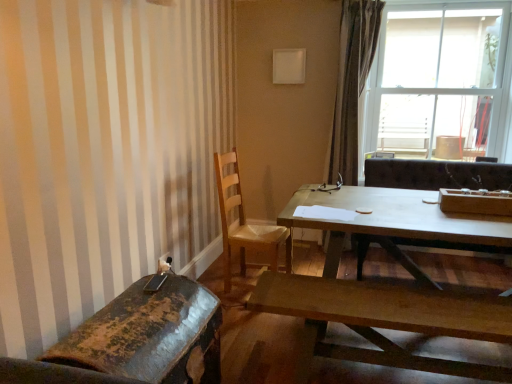
Question: Is transparent glass window at upper right shorter than rusty metal chair at lower left, the 2th chair positioned from the back?

Choices:
 (A) no
 (B) yes

Answer: (A)

Question: Is transparent glass window at upper right far from rusty metal chair at lower left, the 2th chair positioned from the back?

Choices:
 (A) no
 (B) yes

Answer: (B)

Question: Does transparent glass window at upper right have a greater height compared to rusty metal chair at lower left, which is counted as the 1th chair, starting from the front?

Choices:
 (A) no
 (B) yes

Answer: (B)

Question: Can you confirm if transparent glass window at upper right is wider than rusty metal chair at lower left, the 2th chair positioned from the back?

Choices:
 (A) no
 (B) yes

Answer: (B)

Question: Does transparent glass window at upper right have a larger size compared to rusty metal chair at lower left, which is counted as the 1th chair, starting from the front?

Choices:
 (A) no
 (B) yes

Answer: (B)

Question: From the image's perspective, does transparent glass window at upper right appear higher than rusty metal chair at lower left, which is counted as the 1th chair, starting from the front?

Choices:
 (A) yes
 (B) no

Answer: (A)

Question: Can you confirm if rusty metal chair at lower left, the 2th chair positioned from the back, is wider than wooden chair at center, arranged as the 1th chair when viewed from the back?

Choices:
 (A) no
 (B) yes

Answer: (A)

Question: Is the depth of rusty metal chair at lower left, which is counted as the 1th chair, starting from the front, greater than that of wooden chair at center, the 2th chair viewed from the front?

Choices:
 (A) yes
 (B) no

Answer: (B)

Question: Is rusty metal chair at lower left, which is counted as the 1th chair, starting from the front, at the left side of wooden chair at center, arranged as the 1th chair when viewed from the back?

Choices:
 (A) no
 (B) yes

Answer: (B)

Question: Is rusty metal chair at lower left, which is counted as the 1th chair, starting from the front, not close to wooden chair at center, the 2th chair viewed from the front?

Choices:
 (A) yes
 (B) no

Answer: (A)

Question: From a real-world perspective, is rusty metal chair at lower left, which is counted as the 1th chair, starting from the front, on wooden chair at center, the 2th chair viewed from the front?

Choices:
 (A) no
 (B) yes

Answer: (A)

Question: From the image's perspective, is rusty metal chair at lower left, which is counted as the 1th chair, starting from the front, on wooden chair at center, the 2th chair viewed from the front?

Choices:
 (A) no
 (B) yes

Answer: (A)

Question: Could you tell me if wooden bench at lower center, the 2th coffee table viewed from the back, is facing transparent glass window at upper right?

Choices:
 (A) no
 (B) yes

Answer: (A)